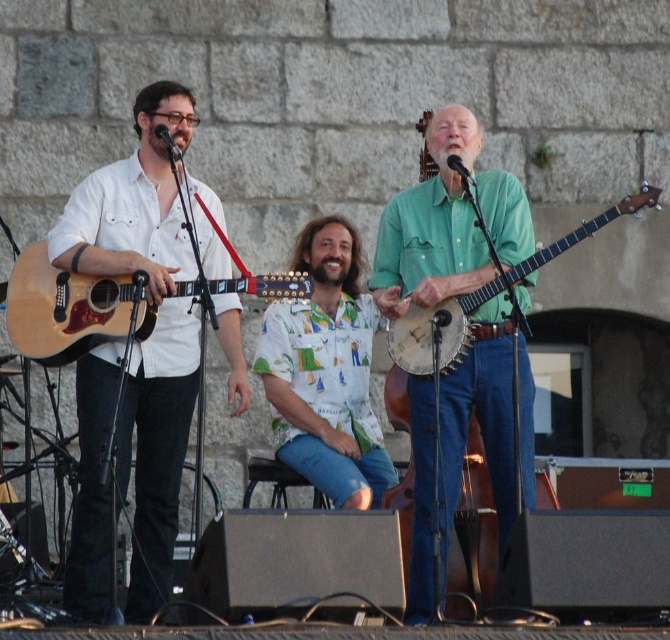
Question: Is hawaiian print shirt at center thinner than natural wood acoustic guitar at center?

Choices:
 (A) yes
 (B) no

Answer: (A)

Question: Which point is farther to the camera?

Choices:
 (A) light brown wooden banjo at center
 (B) hawaiian print shirt at center
 (C) matte white shirt at left

Answer: (B)

Question: Is matte white shirt at left to the left of hawaiian print shirt at center from the viewer's perspective?

Choices:
 (A) yes
 (B) no

Answer: (A)

Question: Among these points, which one is farthest from the camera?

Choices:
 (A) (322, 326)
 (B) (137, 337)

Answer: (A)

Question: Which is farther from the hawaiian print shirt at center?

Choices:
 (A) natural wood acoustic guitar at center
 (B) matte white shirt at left
 (C) light brown wooden banjo at center
 (D) green matte banjo at center

Answer: (A)

Question: Can you confirm if matte white shirt at left is thinner than natural wood acoustic guitar at center?

Choices:
 (A) no
 (B) yes

Answer: (A)